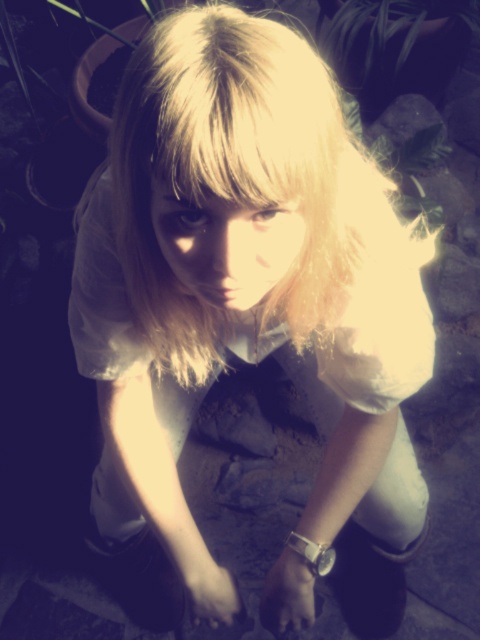
Question: Does dark skin hand at center have a smaller size compared to white matte hand at lower center?

Choices:
 (A) no
 (B) yes

Answer: (A)

Question: Does dark skin hand at center come in front of white matte hand at lower center?

Choices:
 (A) yes
 (B) no

Answer: (A)

Question: Which point is closer to the camera?

Choices:
 (A) white matte hand at lower center
 (B) dark skin hand at center

Answer: (B)

Question: Is dark skin hand at center closer to the viewer compared to white matte hand at lower center?

Choices:
 (A) no
 (B) yes

Answer: (B)